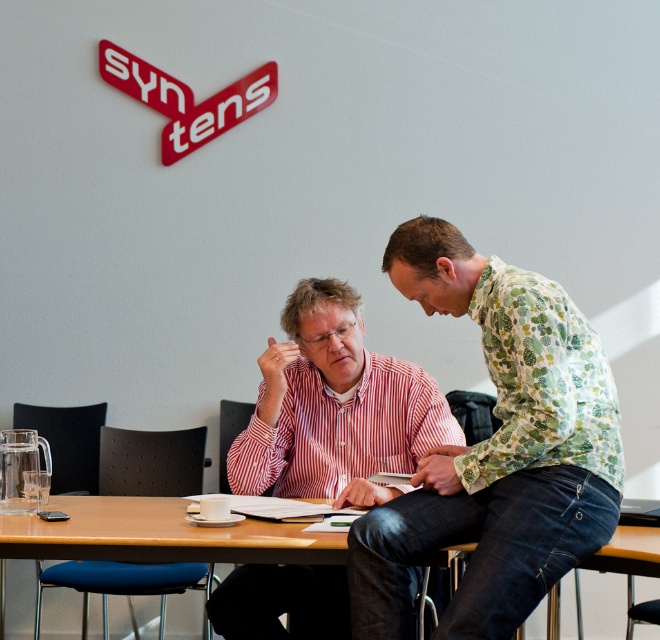
Which is behind, point (370, 396) or point (218, 538)?

Point (370, 396)

Where is `striped cotton shirt at center`? striped cotton shirt at center is located at coordinates (335, 406).

The width and height of the screenshot is (660, 640). Describe the element at coordinates (335, 406) in the screenshot. I see `striped cotton shirt at center` at that location.

Where is `striped cotton shirt at center`? The height and width of the screenshot is (640, 660). striped cotton shirt at center is located at coordinates (335, 406).

Does floral-patterned shirt at center appear on the right side of brown wooden table at center?

Yes, floral-patterned shirt at center is to the right of brown wooden table at center.

Who is positioned more to the left, floral-patterned shirt at center or brown wooden table at center?

brown wooden table at center is more to the left.

Between point (525, 435) and point (106, 552), which one is positioned behind?

The point (106, 552) is behind.

Where is `floral-patterned shirt at center`? This screenshot has width=660, height=640. floral-patterned shirt at center is located at coordinates (496, 451).

Does floral-patterned shirt at center appear on the right side of striped cotton shirt at center?

Indeed, floral-patterned shirt at center is positioned on the right side of striped cotton shirt at center.

Which is in front, point (389, 570) or point (325, 291)?

Point (389, 570)

Image resolution: width=660 pixels, height=640 pixels. Find the location of `floral-patterned shirt at center`. floral-patterned shirt at center is located at coordinates (496, 451).